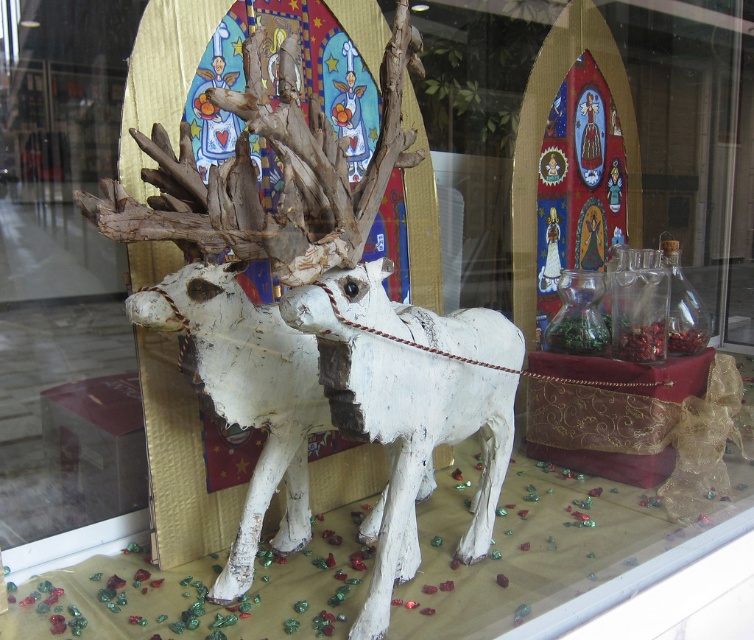
From the picture: You are a customer standing in front of the festive display. You notice two reindeer sculptures at the center. Which one is nearer to you, the white matte reindeer at center or the white painted wood reindeer at center?

The white matte reindeer at center is closer to the viewer than the white painted wood reindeer at center, so the white matte reindeer at center is nearer to you.